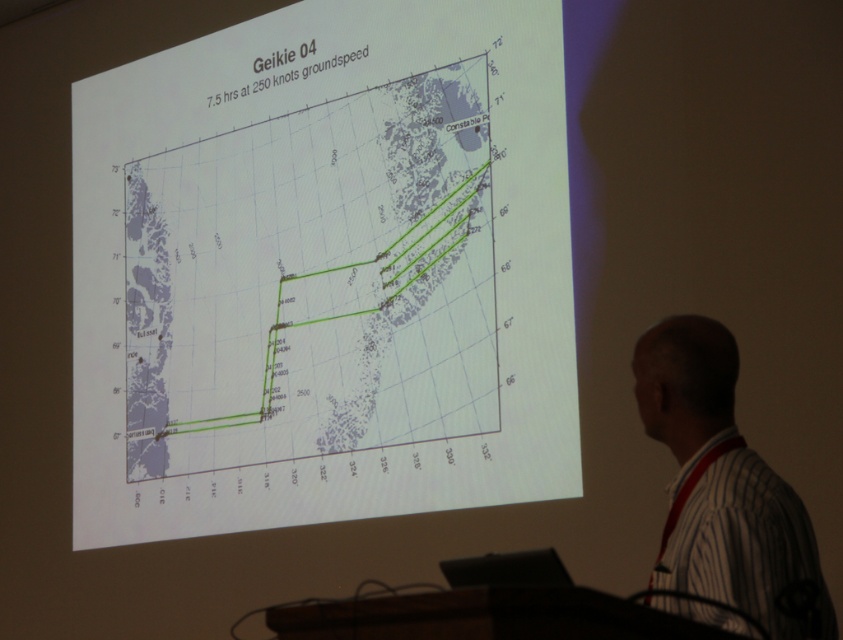
You are an attendee at a lecture and see the green line graph at center and the white striped shirt at right on the screen. Which object takes up more space on the screen?

The green line graph at center is larger in size than the white striped shirt at right, so it takes up more space on the screen.

What is the coordinate of the green line graph at center?

The coordinate of the green line graph at center is point (314, 282).

You are an attendee at the lecture. You notice the green line graph at center and the white striped shirt at right. Which object appears larger in height in the image?

The green line graph at center is taller than the white striped shirt at right.